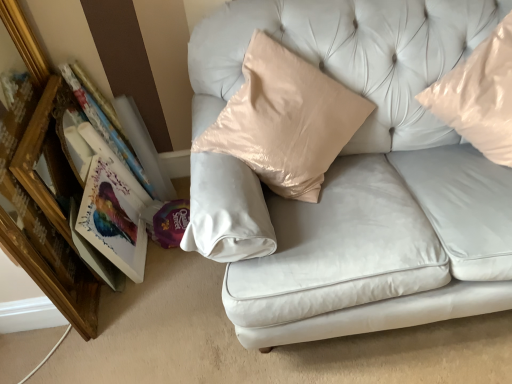
This screenshot has height=384, width=512. Identify the location of free space in front of wooden picture frame at left. (103, 324).